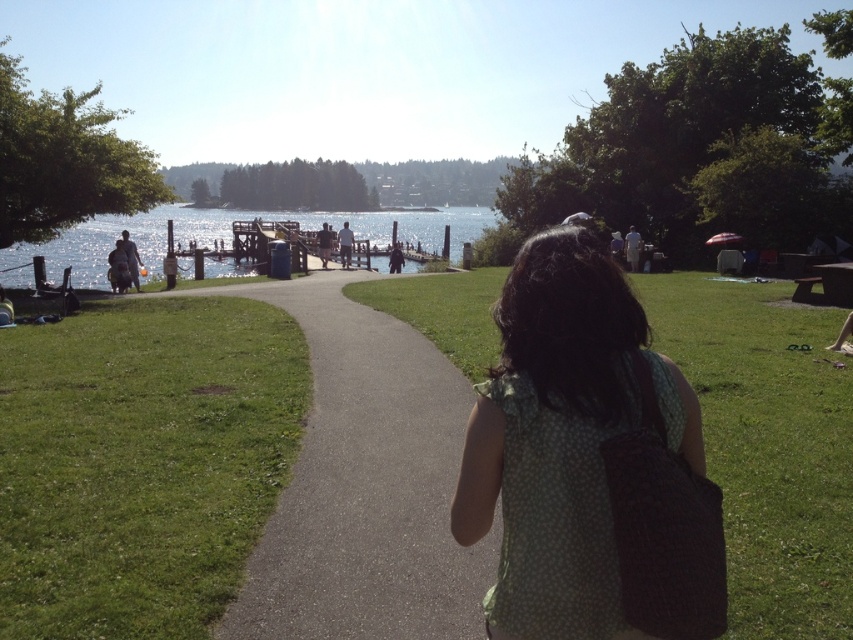
Measure the distance between dark gray fabric bag at left and camera.

They are 22.25 meters apart.

Between dark gray fabric bag at left and white cotton shirt at center, which one appears on the left side from the viewer's perspective?

dark gray fabric bag at left

Between point (111, 253) and point (345, 221), which one is positioned in front?

Point (111, 253)

At what (x,y) coordinates should I click in order to perform the action: click on dark gray fabric bag at left. Please return your answer as a coordinate pair (x, y). This screenshot has height=640, width=853. Looking at the image, I should click on (119, 268).

Which is below, asphalt path at center or shiny metallic water at center?

Positioned lower is asphalt path at center.

Between asphalt path at center and shiny metallic water at center, which one is positioned higher?

shiny metallic water at center

The height and width of the screenshot is (640, 853). What do you see at coordinates (364, 484) in the screenshot? I see `asphalt path at center` at bounding box center [364, 484].

Locate an element on the screen. The image size is (853, 640). asphalt path at center is located at coordinates (364, 484).

Is point (352, 237) behind point (322, 260)?

Yes.

Between point (340, 243) and point (317, 234), which one is positioned in front?

Point (340, 243) is more forward.

Find the location of a particular element. The image size is (853, 640). white cotton shirt at center is located at coordinates (345, 244).